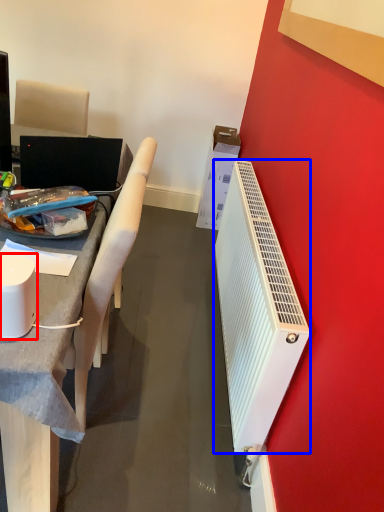
Question: Among these objects, which one is farthest to the camera, appliance (highlighted by a red box) or radiator (highlighted by a blue box)?

Choices:
 (A) appliance
 (B) radiator

Answer: (B)